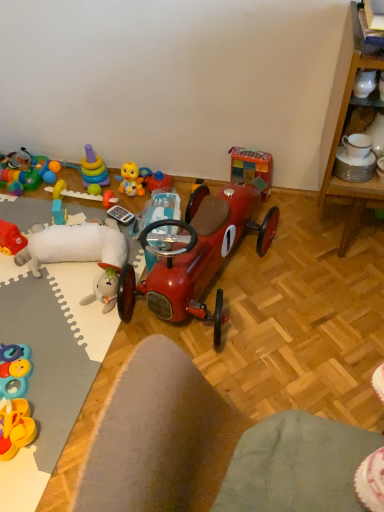
What are the coordinates of `vacant space behind rubberized plastic rings at lower left, the eighth toy viewed from the right` in the screenshot? It's located at (37, 325).